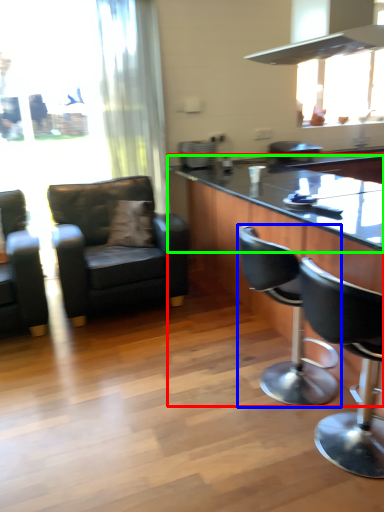
Question: Which object is positioned closest to table (highlighted by a red box)? Select from chair (highlighted by a blue box) and countertop (highlighted by a green box).

Choices:
 (A) chair
 (B) countertop

Answer: (B)